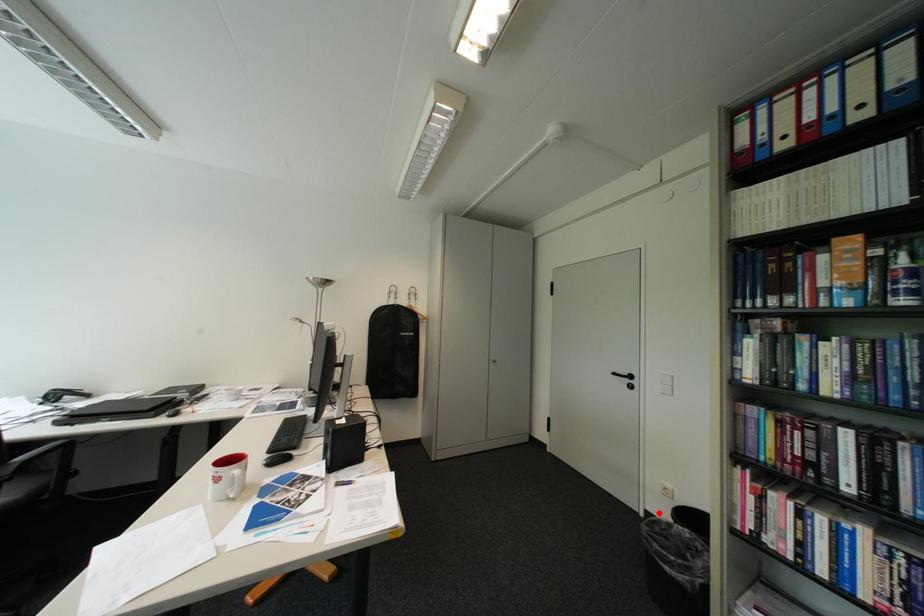
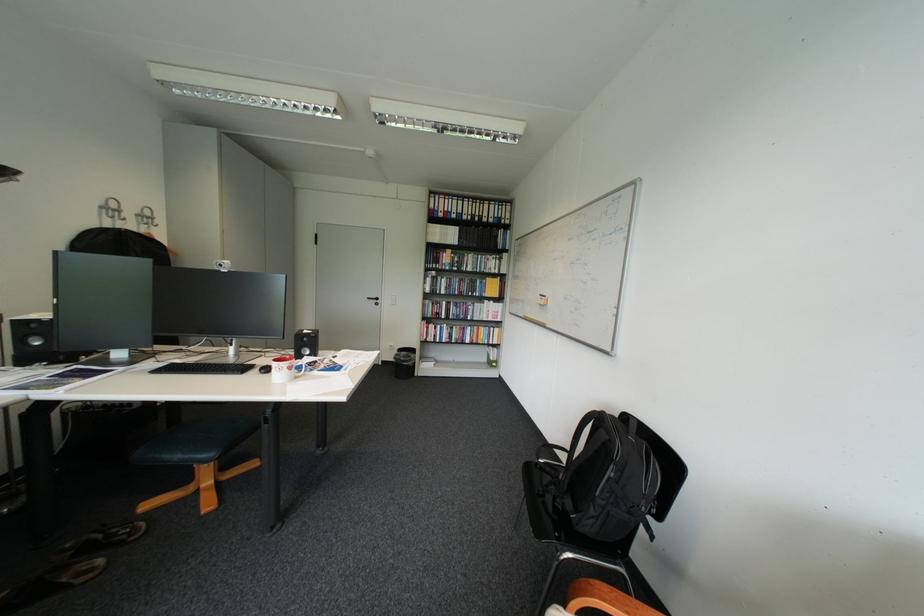
Find the pixel in the second image that matches the highlighted location in the first image.

(395, 362)